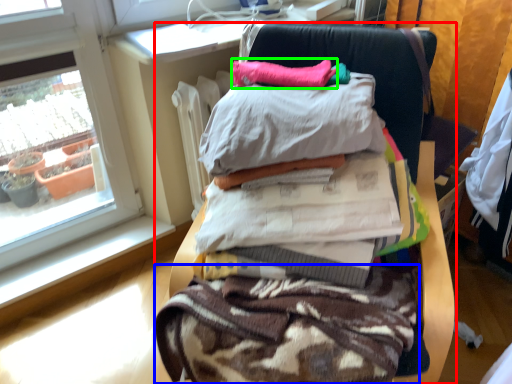
Question: Estimate the real-world distances between objects in this image. Which object is closer to furniture (highlighted by a red box), fabric (highlighted by a blue box) or pillow (highlighted by a green box)?

Choices:
 (A) fabric
 (B) pillow

Answer: (B)